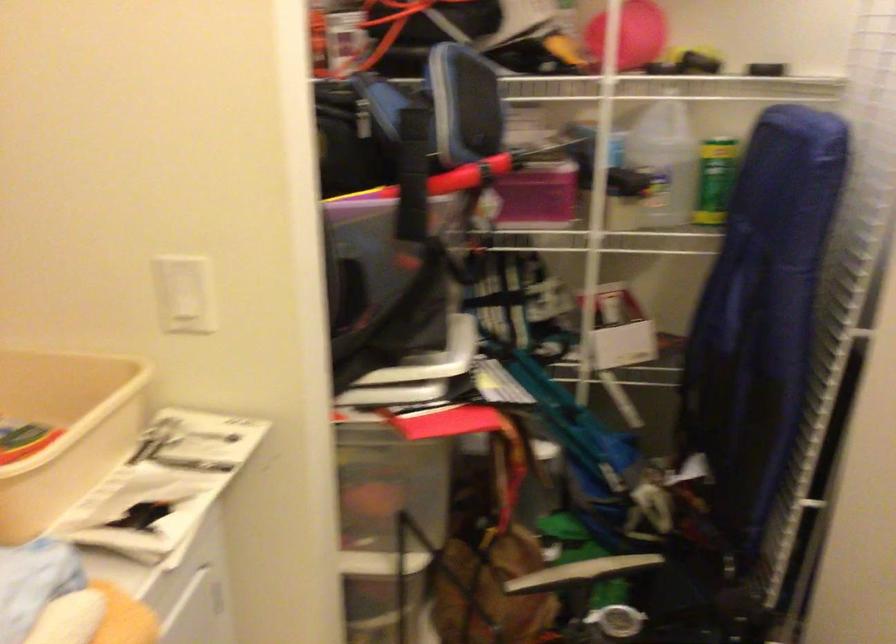
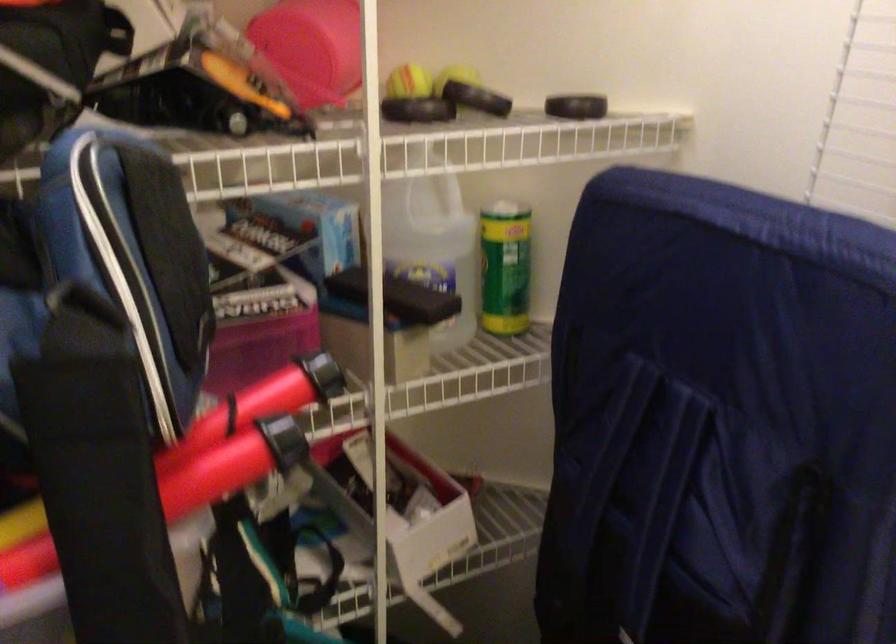
Where in the second image is the point corresponding to (754,69) from the first image?

(576, 106)